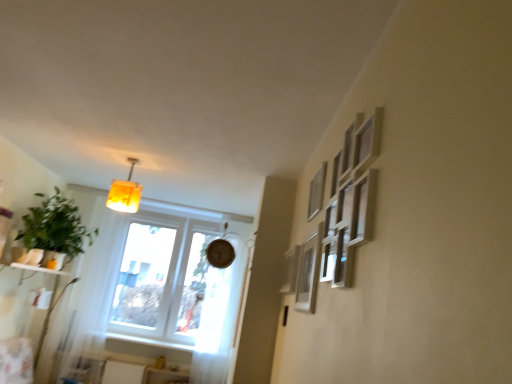
Question: Is there a large distance between white painted wood at lower left and matte silver picture frame at right, arranged as the 3th picture frame when viewed from the back?

Choices:
 (A) yes
 (B) no

Answer: (A)

Question: Can you confirm if white painted wood at lower left is wider than matte silver picture frame at right, arranged as the 3th picture frame when viewed from the back?

Choices:
 (A) no
 (B) yes

Answer: (B)

Question: Is white painted wood at lower left not within matte silver picture frame at right, positioned as the 1th picture frame in front-to-back order?

Choices:
 (A) yes
 (B) no

Answer: (A)

Question: Is white painted wood at lower left looking in the opposite direction of matte silver picture frame at right, positioned as the 1th picture frame in front-to-back order?

Choices:
 (A) no
 (B) yes

Answer: (A)

Question: From a real-world perspective, is white painted wood at lower left located higher than matte silver picture frame at right, positioned as the 1th picture frame in front-to-back order?

Choices:
 (A) no
 (B) yes

Answer: (A)

Question: In terms of height, does matte yellow plastic lamp at upper left look taller or shorter compared to matte silver picture frame at right, arranged as the 3th picture frame when viewed from the back?

Choices:
 (A) tall
 (B) short

Answer: (B)

Question: Is point (134, 182) closer or farther from the camera than point (300, 248)?

Choices:
 (A) farther
 (B) closer

Answer: (A)

Question: From a real-world perspective, is matte yellow plastic lamp at upper left above or below matte silver picture frame at right, arranged as the 3th picture frame when viewed from the back?

Choices:
 (A) above
 (B) below

Answer: (A)

Question: In the image, is matte yellow plastic lamp at upper left positioned in front of or behind matte silver picture frame at right, arranged as the 3th picture frame when viewed from the back?

Choices:
 (A) front
 (B) behind

Answer: (B)

Question: Is white sheer curtain at center spatially inside white painted wood at lower left, or outside of it?

Choices:
 (A) outside
 (B) inside

Answer: (A)

Question: Looking at their shapes, would you say white sheer curtain at center is wider or thinner than white painted wood at lower left?

Choices:
 (A) wide
 (B) thin

Answer: (B)

Question: Based on their positions, is white sheer curtain at center located to the left or right of white painted wood at lower left?

Choices:
 (A) left
 (B) right

Answer: (B)

Question: From a real-world perspective, is white sheer curtain at center physically located above or below white painted wood at lower left?

Choices:
 (A) below
 (B) above

Answer: (B)

Question: Considering their positions, is matte silver picture frame at upper right, which ranks as the 1th picture frame in back-to-front order, located in front of or behind white painted wood at lower left?

Choices:
 (A) front
 (B) behind

Answer: (A)

Question: Is matte silver picture frame at upper right, the third picture frame when ordered from front to back, inside the boundaries of white painted wood at lower left, or outside?

Choices:
 (A) outside
 (B) inside

Answer: (A)